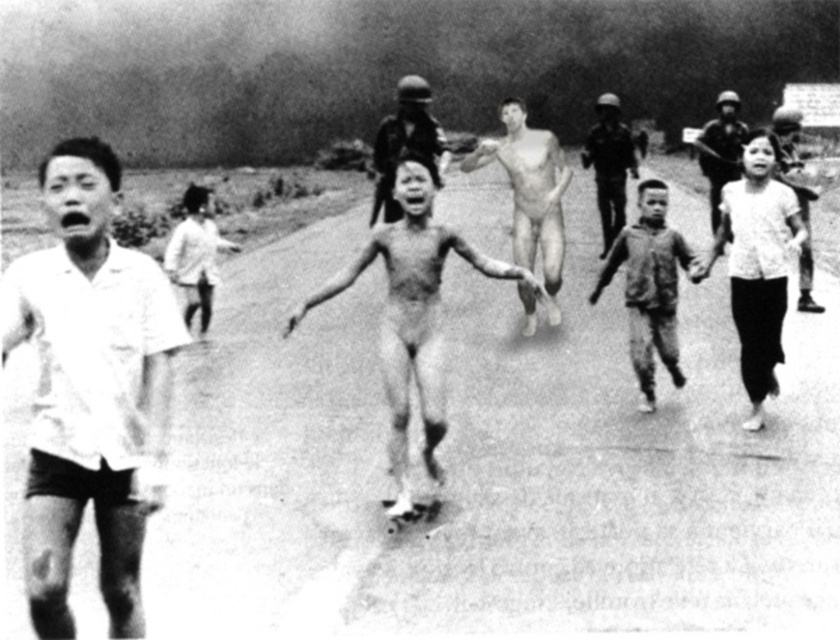
Who is lower down, skinny nude child at center or dirty brown shirt at center?

skinny nude child at center

Who is shorter, skinny nude child at center or dirty brown shirt at center?

Standing shorter between the two is dirty brown shirt at center.

The width and height of the screenshot is (840, 640). Describe the element at coordinates (413, 316) in the screenshot. I see `skinny nude child at center` at that location.

Find the location of a particular element. skinny nude child at center is located at coordinates (x=413, y=316).

Who is lower down, skinny nude child at center or white textured shirt at right?

skinny nude child at center is below.

Does point (397, 484) come farther from viewer compared to point (777, 248)?

No, it is not.

The image size is (840, 640). Identify the location of skinny nude child at center. (413, 316).

Can you confirm if metallic helmet at center is smaller than matte black helmet at upper center?

Yes, metallic helmet at center is smaller than matte black helmet at upper center.

Can you confirm if metallic helmet at center is positioned to the left of matte black helmet at upper center?

Correct, you'll find metallic helmet at center to the left of matte black helmet at upper center.

Is point (606, 115) closer to viewer compared to point (725, 150)?

No, (606, 115) is further to viewer.

Locate an element on the screen. This screenshot has width=840, height=640. metallic helmet at center is located at coordinates (610, 163).